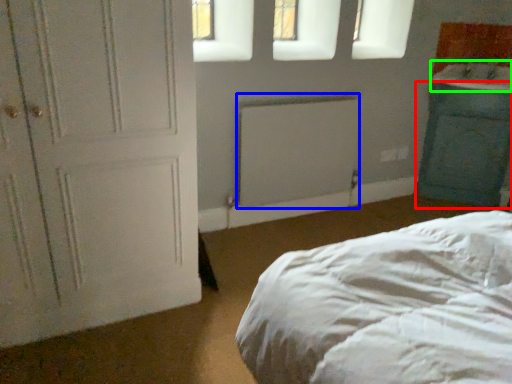
Question: Estimate the real-world distances between objects in this image. Which object is farther from cabinetry (highlighted by a red box), radiator (highlighted by a blue box) or sink (highlighted by a green box)?

Choices:
 (A) radiator
 (B) sink

Answer: (A)